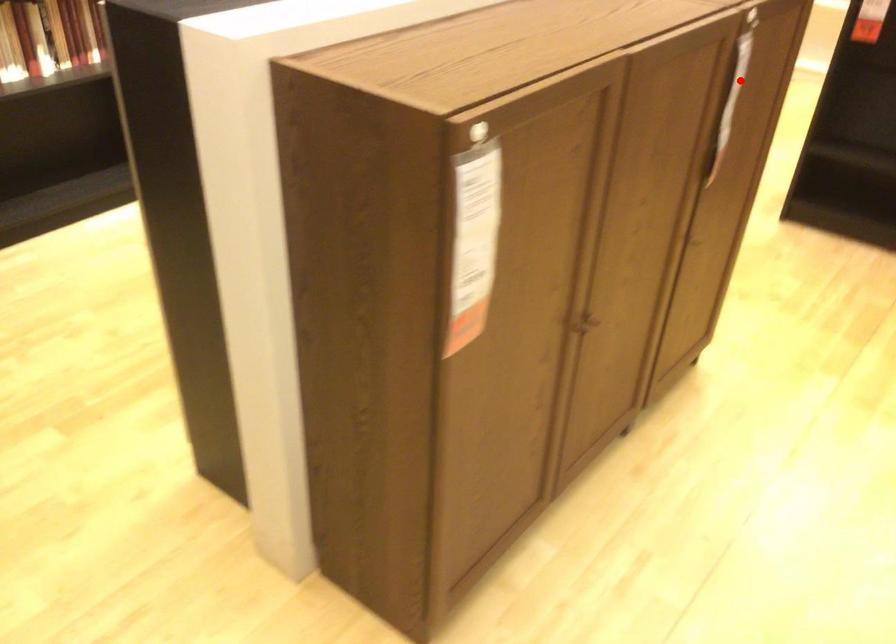
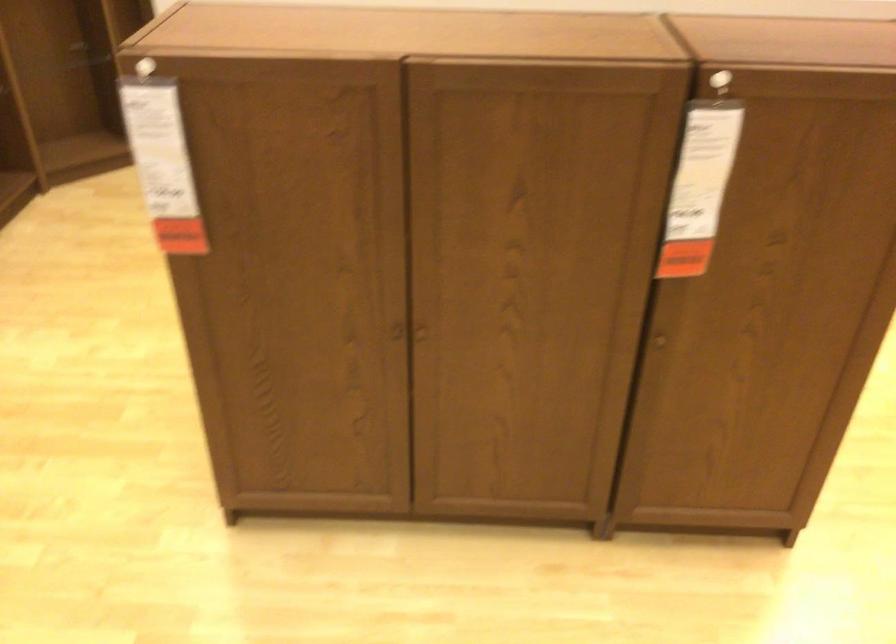
Question: I am providing you with two images of the same scene from different viewpoints. Image1 has a red point marked. In image2, the corresponding 3D location appears at what relative position? Reply with the corresponding letter.

Choices:
 (A) Closer
 (B) Farther

Answer: (A)